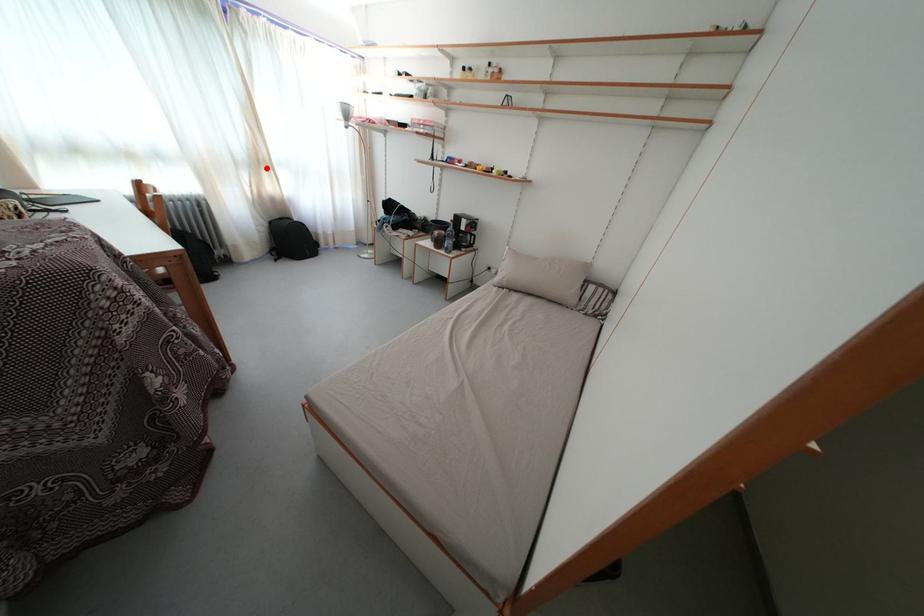
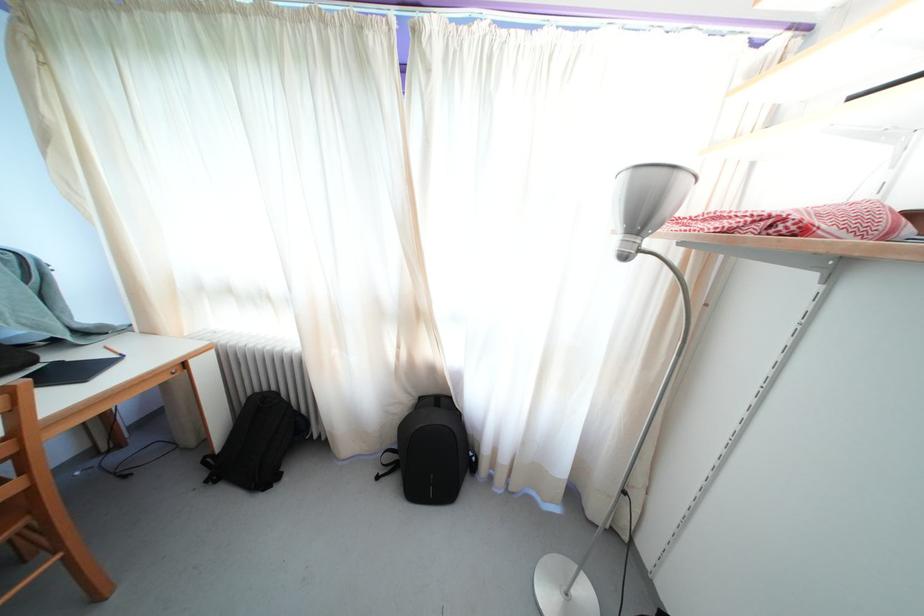
Question: I am providing you with two images of the same scene from different viewpoints. Image1 has a red point marked. In image2, the corresponding 3D location appears at what relative position? Reply with the corresponding letter.

Choices:
 (A) Closer
 (B) Farther

Answer: (B)